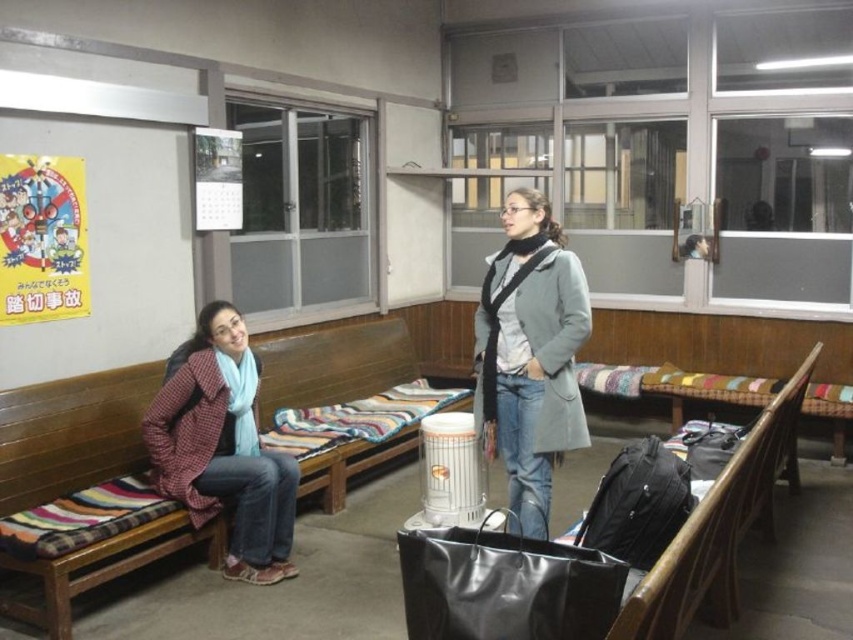
Question: Is wooden bench with striped cushion at left to the right of gray wool coat at center from the viewer's perspective?

Choices:
 (A) no
 (B) yes

Answer: (A)

Question: Which point appears closest to the camera in this image?

Choices:
 (A) (524, 440)
 (B) (310, 340)

Answer: (A)

Question: Which object is farther from the camera taking this photo?

Choices:
 (A) gray wool coat at center
 (B) wooden bench with striped cushion at left

Answer: (A)

Question: Is gray wool coat at center to the right of plaid woolen jacket at left from the viewer's perspective?

Choices:
 (A) no
 (B) yes

Answer: (B)

Question: Which point is closer to the camera?

Choices:
 (A) (338, 337)
 (B) (189, 413)

Answer: (B)

Question: Is wooden bench with striped cushion at left bigger than gray wool coat at center?

Choices:
 (A) yes
 (B) no

Answer: (A)